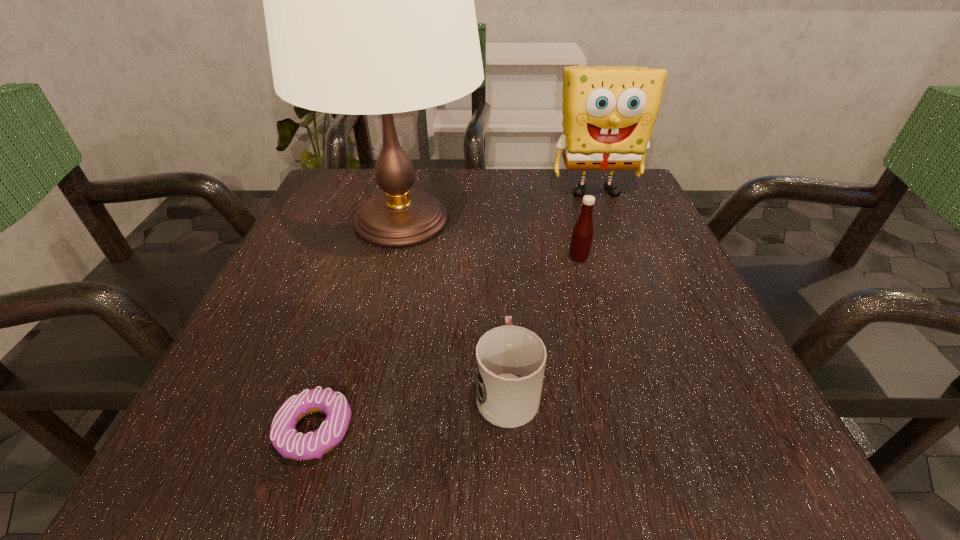
Image resolution: width=960 pixels, height=540 pixels. I want to click on free point that satisfies the following two spatial constraints: 1. on the handle side of the cup; 2. on the right side of the Tabasco sauce, so click(500, 258).